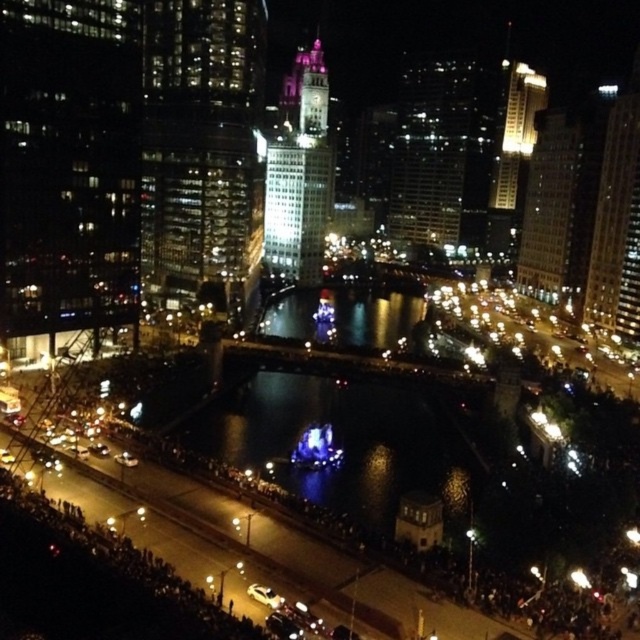
You are a photographer planning to capture the city skyline at night. You notice the glassy reflective skyscraper at upper left and the white glossy building at upper right. Which building would you focus on if you want to highlight a structure that appears narrower in the photo?

The glassy reflective skyscraper at upper left is thinner than the white glossy building at upper right, so focusing on it would highlight the narrower structure.

You are a photographer standing on the riverbank and want to capture the reflection of the matte glass skyscraper at upper right in the dark reflective water at center. Can you see its reflection in the water?

Yes, because the dark reflective water at center is positioned under the matte glass skyscraper at upper right, so the skyscraper would be reflected in the water below it.

You are standing at the point marked by the coordinates point (340, 442) in the image. Looking around, you see dark reflective water at center. What is directly beneath your feet?

The point (340, 442) indicates dark reflective water at center, so the dark reflective water at center is directly beneath your feet.